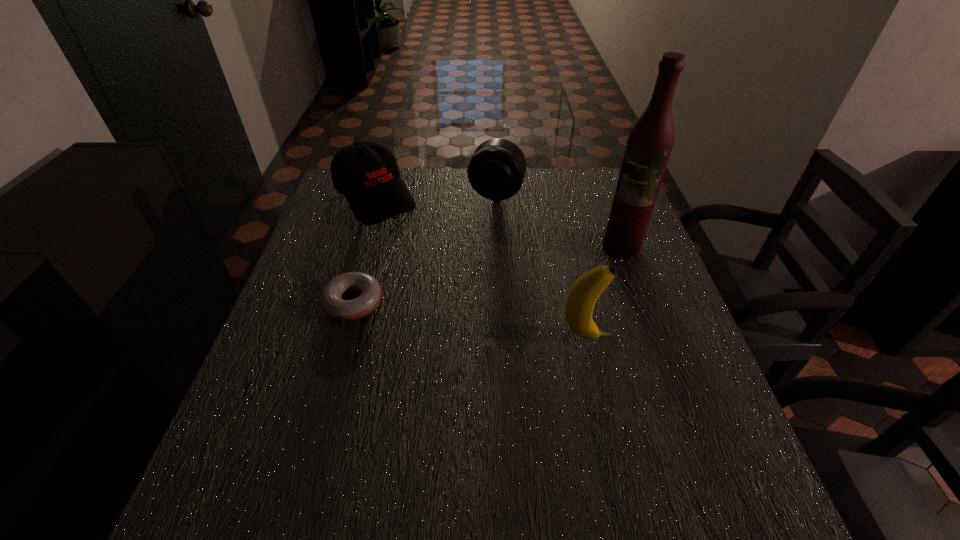
You are a GUI agent. You are given a task and a screenshot of the screen. Output one action in this format:
    pyautogui.click(x=<x>, y=<y>)
    Task: Click on the third closest object to the fourth object from left to right
    
    Given the screenshot: What is the action you would take?
    pyautogui.click(x=496, y=171)

Find the location of a particular element. the second closest object relative to the third object from right to left is located at coordinates 650,141.

This screenshot has height=540, width=960. I want to click on blank space that satisfies the following two spatial constraints: 1. on the back side of the telephoto lens; 2. on the right side of the baseball cap, so click(x=377, y=191).

The image size is (960, 540). What are the coordinates of `free region that satisfies the following two spatial constraints: 1. on the front side of the baseball cap; 2. from the stem of the second tallest object` in the screenshot? It's located at (333, 338).